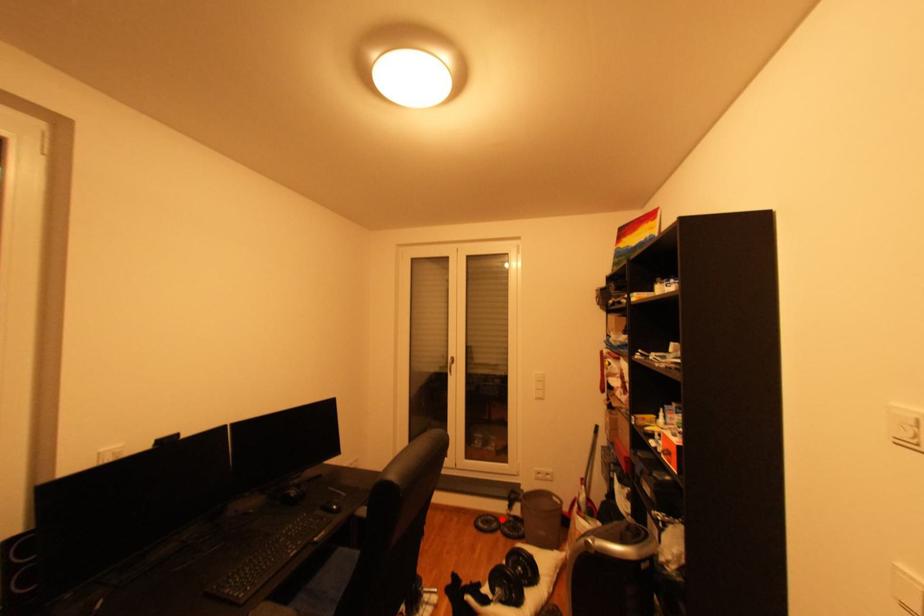
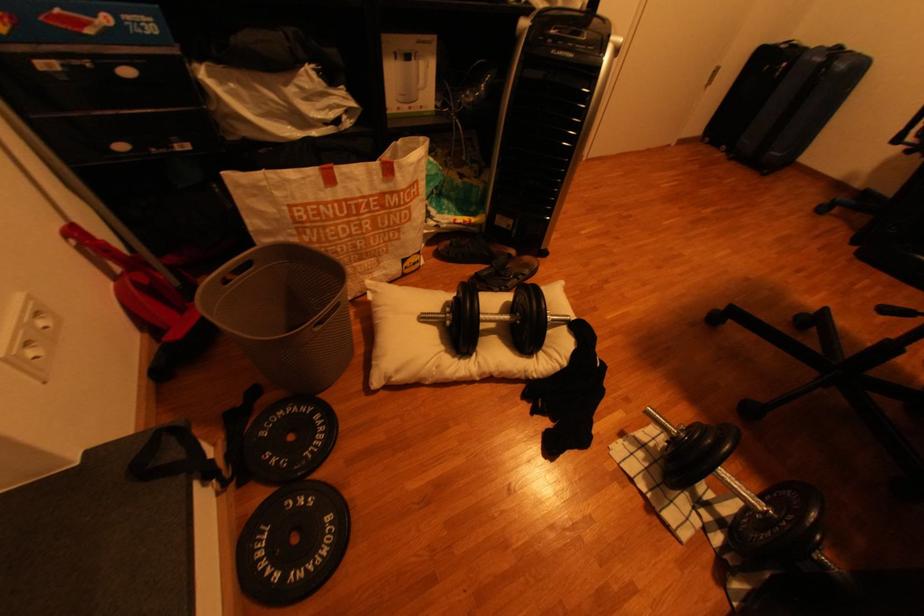
Find the pixel in the second image that matches the highlighted location in the first image.

(274, 540)